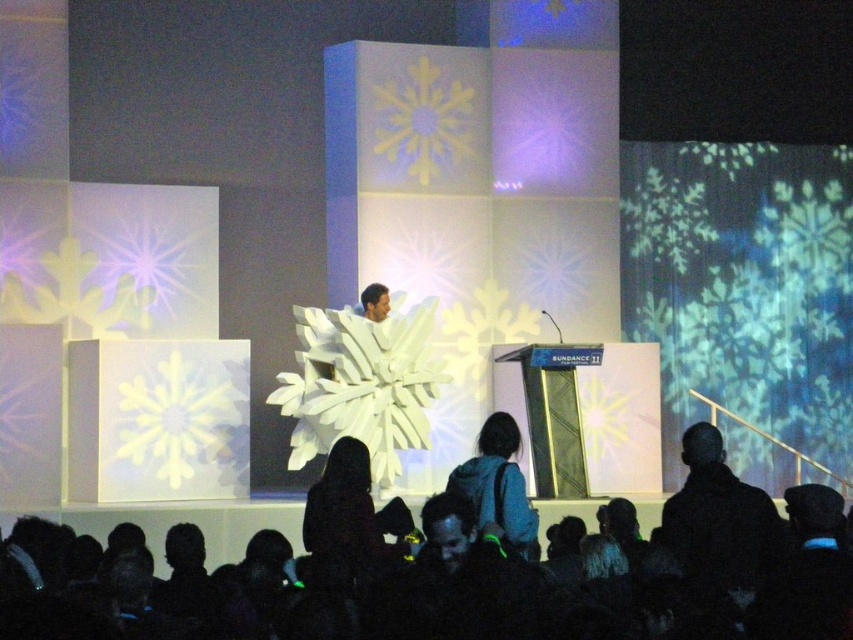
Based on the photo, you are an event organizer who needs to ensure the black fabric at lower center and the black matte jacket at lower right are visible to the audience. Given that the stage has limited space, which object should be moved closer to the front to ensure visibility, and why?

The black matte jacket at lower right should be moved closer to the front because its width is smaller than the black fabric at lower center, allowing it to occupy less space while maintaining visibility.

You are a photographer at the event and want to capture both the black matte jacket at lower right and the dark brown leather jacket at center in a single shot. Which jacket should you position closer to the camera to ensure both are visible without any obstruction?

The dark brown leather jacket at center is behind the black matte jacket at lower right, so to ensure both are visible without obstruction, you should position the black matte jacket at lower right closer to the camera.

You are an event organizer who needs to arrange a path for attendees to walk around the black matte jacket at lower right and the blue backpack at center. Which object requires a wider path due to its larger size?

The black matte jacket at lower right requires a wider path because its width surpasses that of the blue backpack at center.